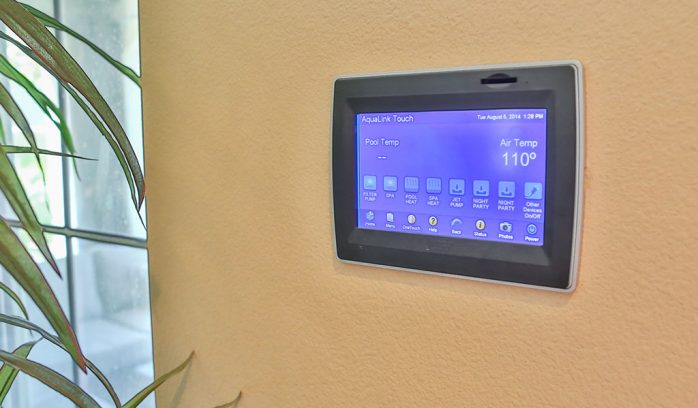
This screenshot has width=698, height=408. Find the location of `wall`. wall is located at coordinates click(273, 68).